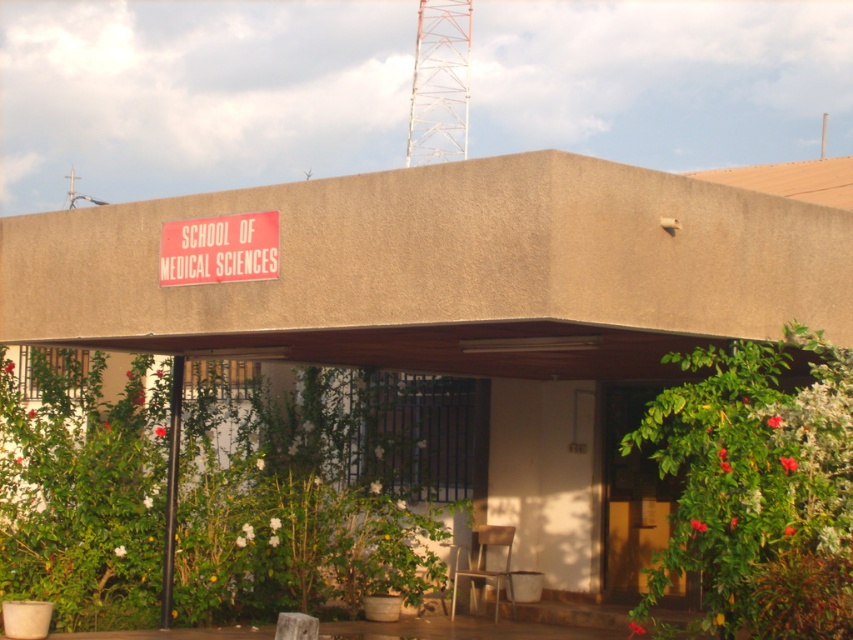
This screenshot has height=640, width=853. In order to click on brown wooden door at center in this screenshot , I will do `click(631, 493)`.

Locate an element on the screen. brown wooden door at center is located at coordinates (631, 493).